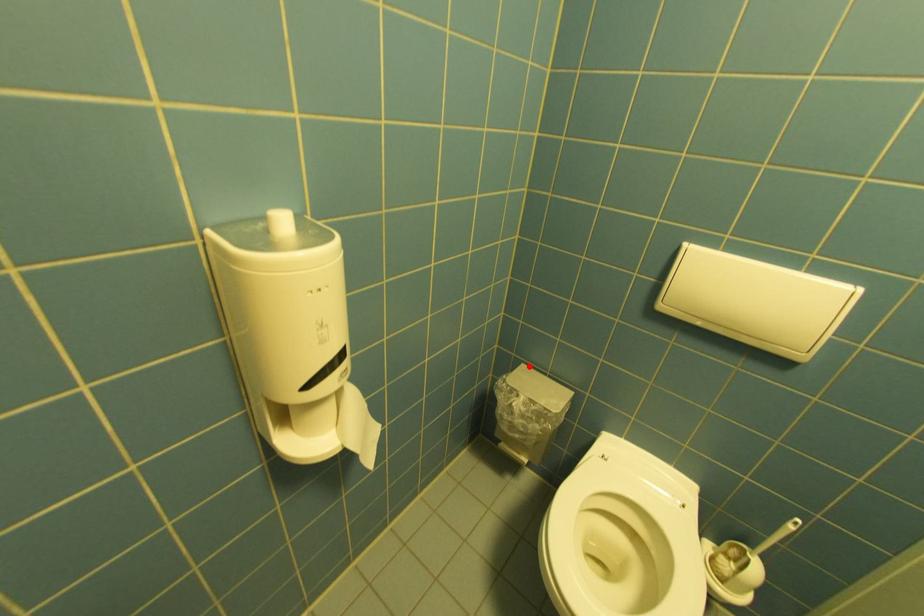
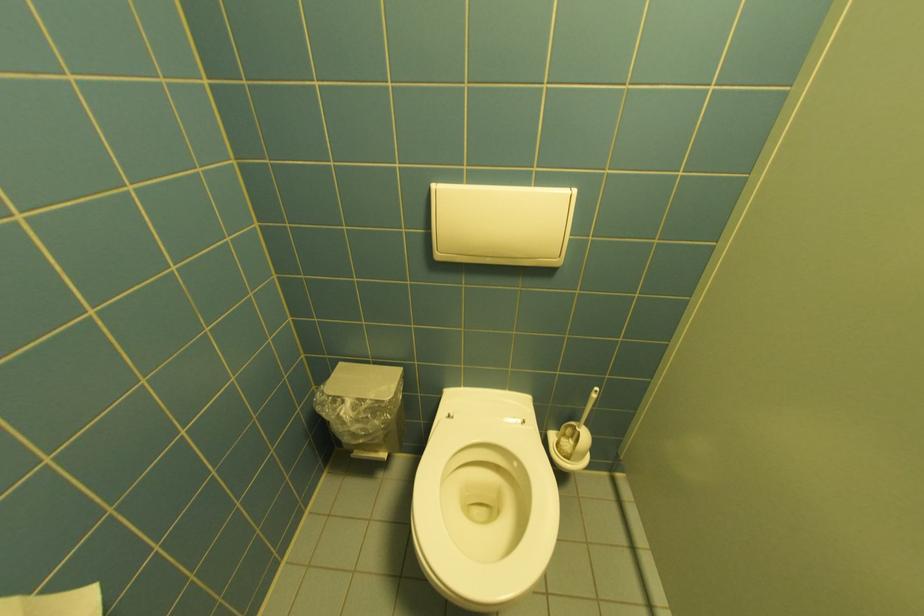
Find the pixel in the second image that matches the highlighted location in the first image.

(347, 365)